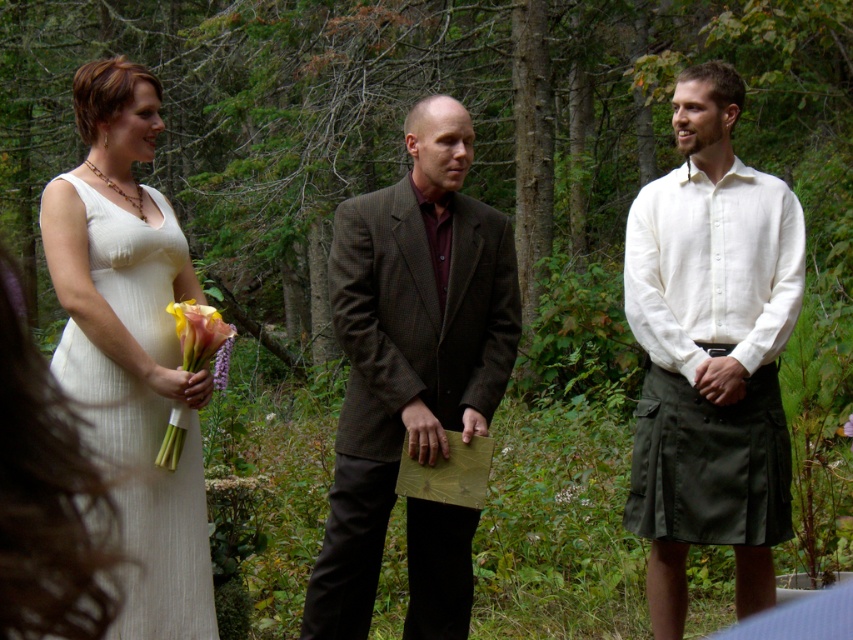
You are a photographer at a wedding ceremony and need to adjust the camera focus. The brown wool suit at center and the white textured dress at left are both in the frame. Which one should you focus on first if you want to prioritize the smaller object?

The brown wool suit at center should be focused on first since it has a smaller size compared to the white textured dress at left.

You are a photographer at a wedding ceremony and need to position a camera to capture the brown wool suit at center. What are the coordinates where you should aim the camera?

The coordinates for the brown wool suit at center are at point (x=409, y=346), so aim the camera there.

From the picture: You are a photographer at a wedding ceremony. You need to position a camera tripod between the brown wool suit at center and the soft pastel calla lilies at left. Since the tripod requires a clear space, will the height difference between them allow the tripod to be placed there without obstruction?

The brown wool suit at center is taller than the soft pastel calla lilies at left, so placing the tripod between them would be possible as long as the area between them is clear. The height difference might not obstruct the tripod, but ensure there is enough space between them for the tripod legs.